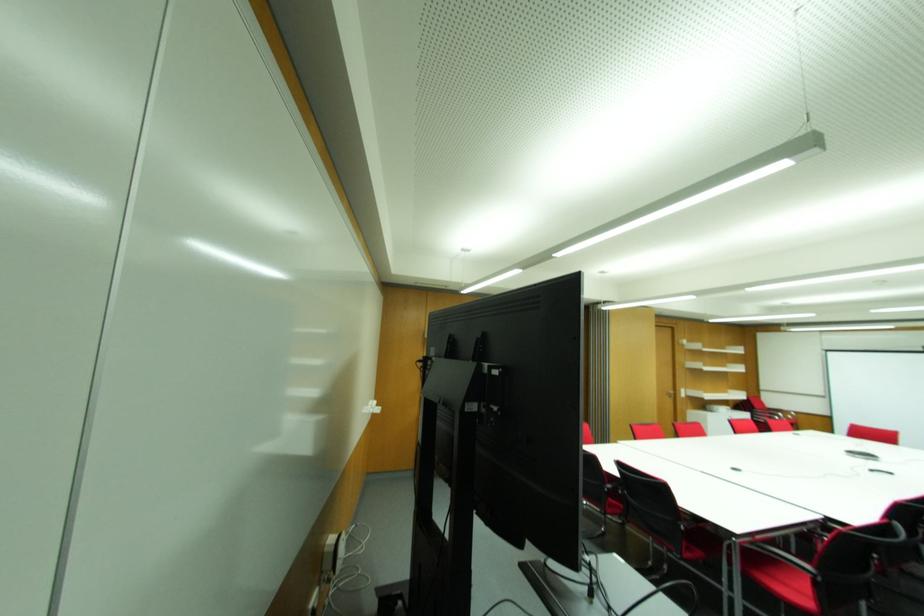
You are a GUI agent. You are given a task and a screenshot of the screen. Output one action in this format:
    pyautogui.click(x=<x>, y=<y>)
    Task: Click on the metal door handle
    
    Given the screenshot: What is the action you would take?
    pyautogui.click(x=670, y=392)